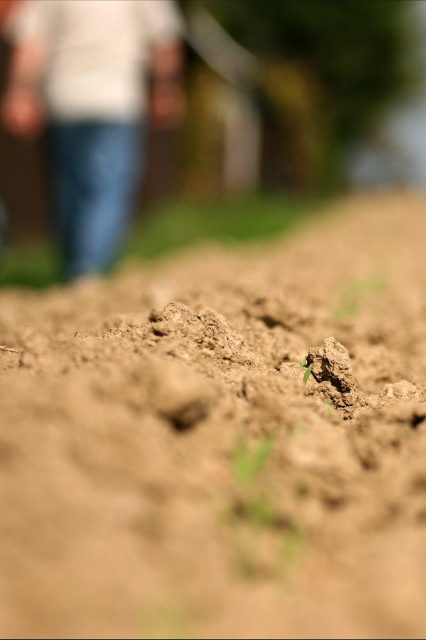
Describe the element at coordinates (221, 440) in the screenshot. I see `brown soil at center` at that location.

Looking at this image, who is taller, brown soil at center or denim jeans at left?

With more height is denim jeans at left.

This screenshot has height=640, width=426. Describe the element at coordinates (221, 440) in the screenshot. I see `brown soil at center` at that location.

Where is `brown soil at center`? The width and height of the screenshot is (426, 640). brown soil at center is located at coordinates (221, 440).

Which is more to the left, denim jeans at left or green grass at center?

denim jeans at left

Can you confirm if denim jeans at left is positioned below green grass at center?

No.

Between point (26, 22) and point (235, 561), which one is positioned in front?

Point (235, 561) is in front.

I want to click on denim jeans at left, so click(92, 106).

Is brown soil at center closer to camera compared to green grass at center?

That is True.

Does brown soil at center have a greater width compared to green grass at center?

Correct, the width of brown soil at center exceeds that of green grass at center.

Does point (247, 298) come closer to viewer compared to point (236, 536)?

No, (247, 298) is further to viewer.

At what (x,y) coordinates should I click in order to perform the action: click on brown soil at center. Please return your answer as a coordinate pair (x, y). Looking at the image, I should click on (221, 440).